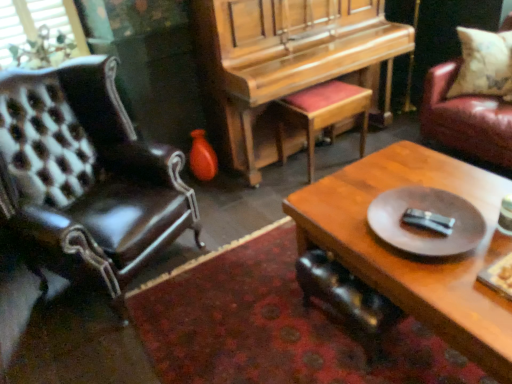
Question: Would you say shiny orange vase at center is to the left or to the right of wooden piano at center in the picture?

Choices:
 (A) right
 (B) left

Answer: (B)

Question: Relative to wooden piano at center, is shiny orange vase at center in front or behind?

Choices:
 (A) front
 (B) behind

Answer: (B)

Question: Which of these objects is positioned farthest from the shiny black leather chair at lower center, marked as the 1th chair in a right-to-left arrangement?

Choices:
 (A) white mesh window screen at upper left
 (B) black plastic remote control at center
 (C) wooden coffee table at center
 (D) leather chair at left, which is counted as the 1th chair, starting from the left
 (E) leather cushion at right

Answer: (E)

Question: Estimate the real-world distances between objects in this image. Which object is closer to the wooden coffee table at center?

Choices:
 (A) white mesh window screen at upper left
 (B) leather chair at left, the second chair viewed from the right
 (C) leather cushion at right
 (D) velvet red stool at center
 (E) shiny orange vase at center

Answer: (D)